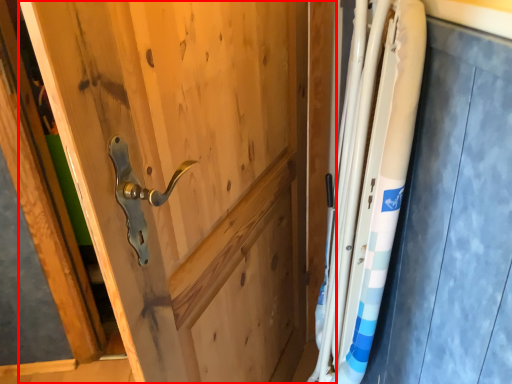
Question: Considering the relative positions of door (annotated by the red box) and steel in the image provided, where is door (annotated by the red box) located with respect to the staircase?

Choices:
 (A) left
 (B) right

Answer: (A)